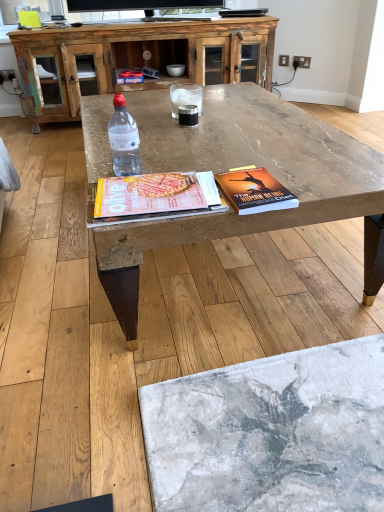
Locate an element on the screen. vacant space behind matte paper magazine at center is located at coordinates (184, 157).